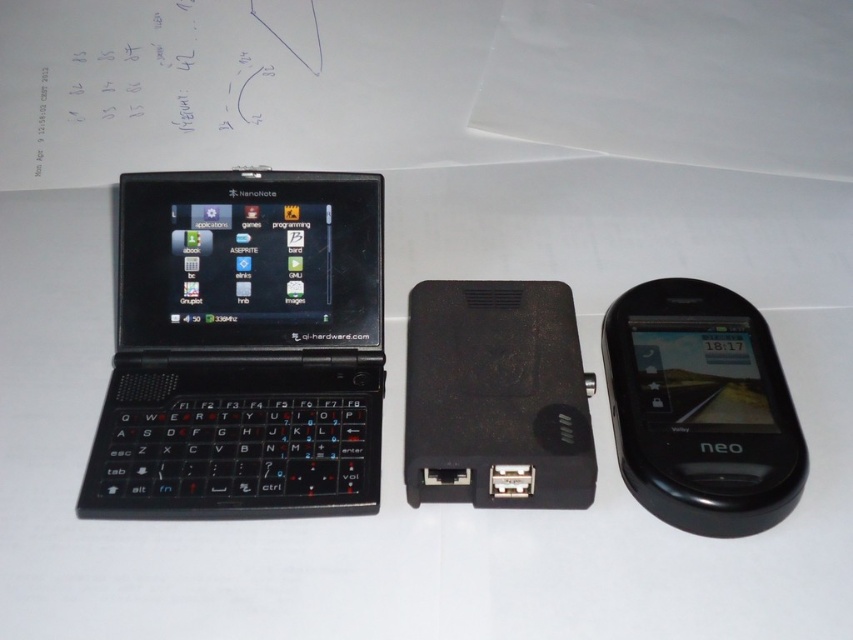
Based on the photo, where is the black matte laptop at left located in the image?

The black matte laptop at left is located at point [242,348] in the image.

You are organizing a tech showcase and need to arrange the black matte laptop at left and the black glossy neo phone at right in a row from left to right. Based on their current positions, which device should be placed first on the left side?

The black matte laptop at left should be placed first on the left side since it is already positioned to the left of the black glossy neo phone at right.

You are setting up a desk and want to arrange the black matte laptop at left and the black glossy neo phone at right so that both are visible without overlapping. Given their height difference, which device should be placed higher to ensure both are fully visible?

The black matte laptop at left is much taller than the black glossy neo phone at right, so place the black matte laptop at left lower to allow the shorter black glossy neo phone at right to be seen above it.